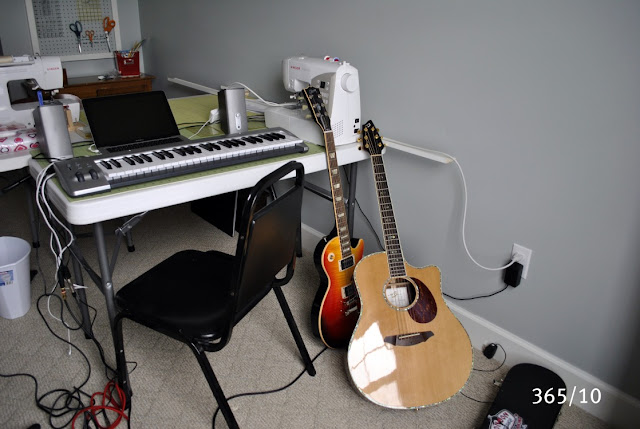
Where is `wall`? The height and width of the screenshot is (429, 640). wall is located at coordinates [576, 87].